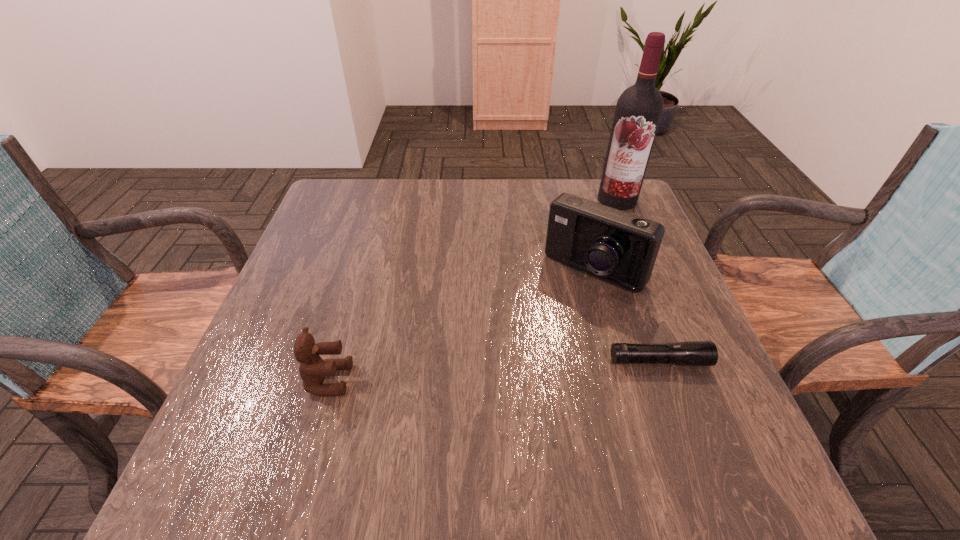
In order to click on vacant space situated on the label of the farthest object in this screenshot , I will do `click(586, 238)`.

Where is `vacant space located on the front-facing side of the camera`? vacant space located on the front-facing side of the camera is located at coordinates (511, 360).

At what (x,y) coordinates should I click in order to perform the action: click on vacant space located on the front-facing side of the camera. Please return your answer as a coordinate pair (x, y). The width and height of the screenshot is (960, 540). Looking at the image, I should click on (499, 373).

The height and width of the screenshot is (540, 960). I want to click on vacant region located on the front-facing side of the camera, so click(542, 323).

Identify the location of object situated at the far edge. pos(639,108).

Identify the location of object that is at the near edge. click(313, 369).

Locate an element on the screen. Image resolution: width=960 pixels, height=540 pixels. object present at the left edge is located at coordinates (313, 369).

Find the location of a particular element. Image resolution: width=960 pixels, height=540 pixels. flashlight situated at the right edge is located at coordinates (693, 353).

Where is `wine bottle present at the right edge`? This screenshot has width=960, height=540. wine bottle present at the right edge is located at coordinates (639, 108).

Locate an element on the screen. The image size is (960, 540). camera located in the right edge section of the desktop is located at coordinates (616, 246).